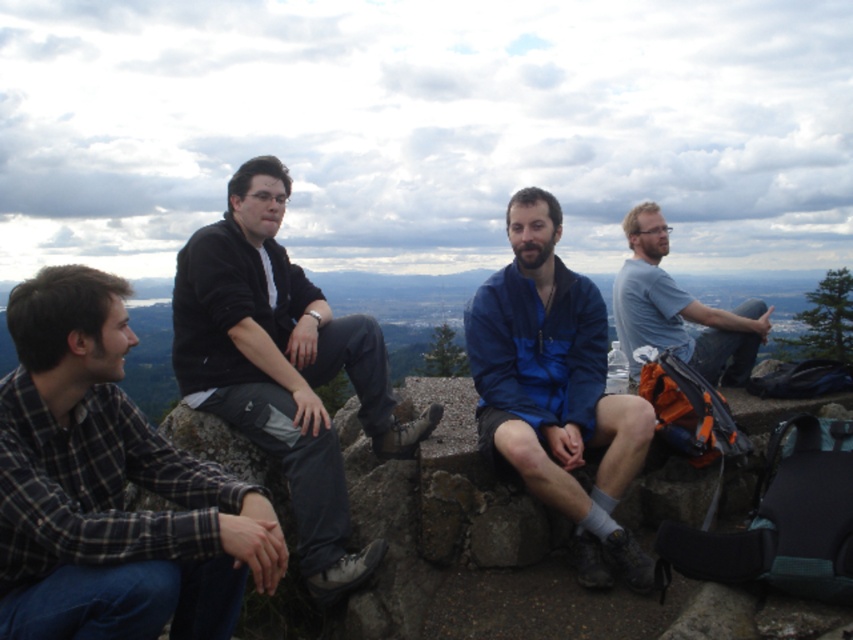
Does point (312, 554) come farther from viewer compared to point (639, 314)?

No, it is in front of (639, 314).

Does dark gray fabric pants at center have a greater height compared to gray cotton t-shirt at upper right?

Yes.

Looking at this image, who is more forward, (271, 253) or (724, 349)?

Point (271, 253) is in front.

Image resolution: width=853 pixels, height=640 pixels. I want to click on dark gray fabric pants at center, so coord(283,368).

Where is `flannel shirt at left`? flannel shirt at left is located at coordinates (109, 486).

Who is more forward, (202, 481) or (339, 472)?

Point (202, 481)

Is point (112, 371) closer to viewer compared to point (273, 289)?

Yes, point (112, 371) is in front of point (273, 289).

I want to click on flannel shirt at left, so click(x=109, y=486).

Between flannel shirt at left and gray cotton t-shirt at upper right, which one is positioned lower?

flannel shirt at left is below.

Is flannel shirt at left smaller than gray cotton t-shirt at upper right?

Indeed, flannel shirt at left has a smaller size compared to gray cotton t-shirt at upper right.

Locate an element on the screen. flannel shirt at left is located at coordinates (109, 486).